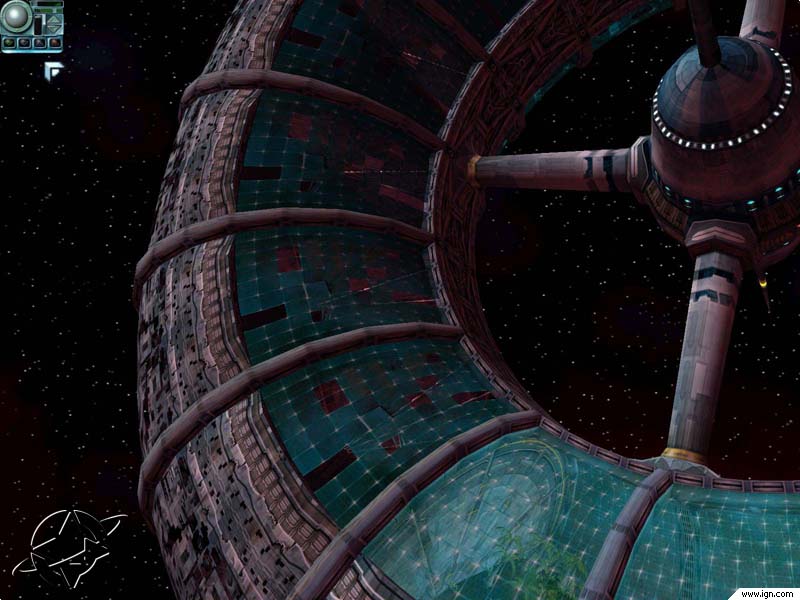
Identify the location of rectangular dark brown windows. The width and height of the screenshot is (800, 600). (338, 460), (258, 318), (265, 171).